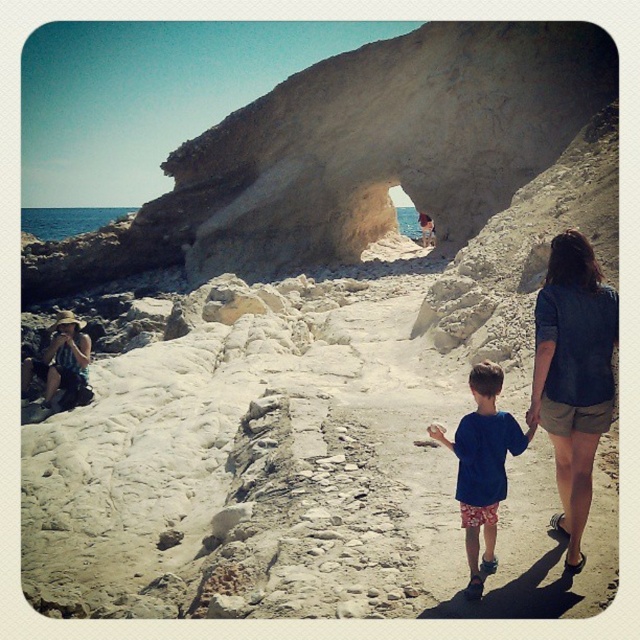
Question: Considering the relative positions of beige stone arch at center and blue cotton shirt at center in the image provided, where is beige stone arch at center located with respect to blue cotton shirt at center?

Choices:
 (A) right
 (B) left

Answer: (A)

Question: Which of the following is the farthest from the observer?

Choices:
 (A) blue cotton shirt at center
 (B) beige stone arch at center

Answer: (B)

Question: Among these points, which one is nearest to the camera?

Choices:
 (A) (474, 540)
 (B) (566, 244)

Answer: (A)

Question: Is beige stone arch at center above blue cotton shirt at center?

Choices:
 (A) no
 (B) yes

Answer: (B)

Question: Observing the image, what is the correct spatial positioning of beige stone arch at center in reference to blue cotton shirt at center?

Choices:
 (A) right
 (B) left

Answer: (A)

Question: Among these objects, which one is farthest from the camera?

Choices:
 (A) beige stone arch at center
 (B) denim shorts at right

Answer: (A)